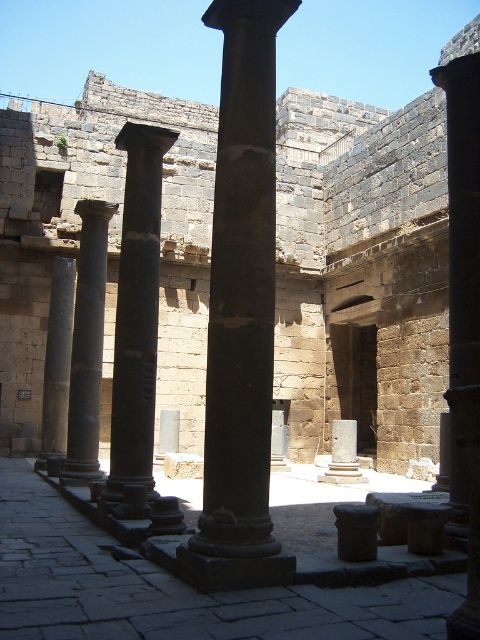
Which is above, black polished column at right or smooth gray column at left?

black polished column at right is higher up.

Based on the photo, between black polished column at right and smooth gray column at left, which one is positioned lower?

Positioned lower is smooth gray column at left.

The width and height of the screenshot is (480, 640). Identify the location of black polished column at right. (462, 259).

Find the location of a particular element. The height and width of the screenshot is (640, 480). black polished column at right is located at coordinates (462, 259).

Which is more to the right, black polished column at center or dark gray stone column at center?

From the viewer's perspective, black polished column at center appears more on the right side.

Does black polished column at center appear under dark gray stone column at center?

Correct, black polished column at center is located below dark gray stone column at center.

Who is more distant from viewer, (268, 540) or (152, 305)?

Point (152, 305)

Where is `black polished column at center`? black polished column at center is located at coordinates (240, 312).

Who is shorter, black polished column at center or smooth gray column at left?

smooth gray column at left

Does black polished column at center have a lesser height compared to smooth gray column at left?

No.

Identify the location of black polished column at center. 240,312.